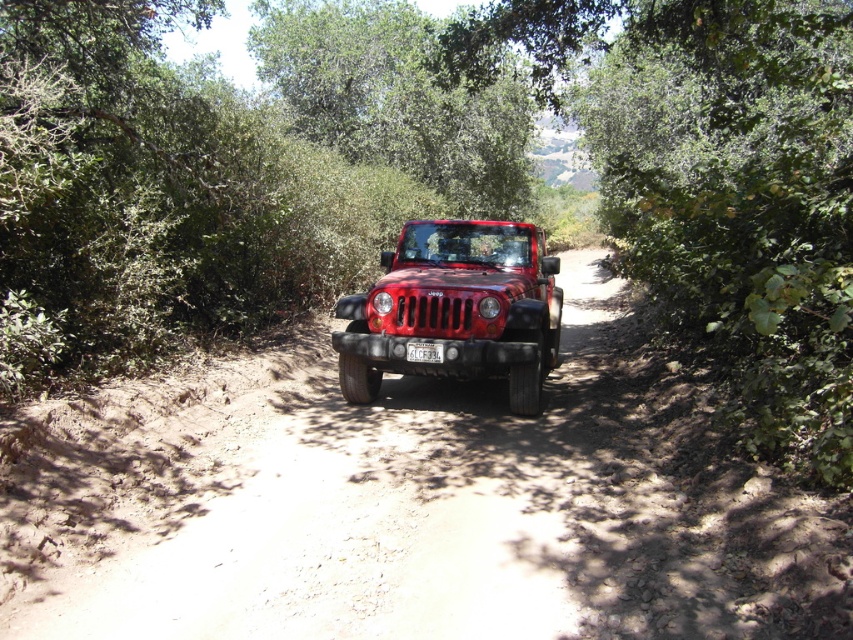
Question: Can you confirm if green leafy tree at center is bigger than matte red jeep at center?

Choices:
 (A) yes
 (B) no

Answer: (A)

Question: Which of the following is the closest to the observer?

Choices:
 (A) green leafy tree at center
 (B) matte red jeep at center

Answer: (A)

Question: Observing the image, what is the correct spatial positioning of green leafy tree at center in reference to matte red jeep at center?

Choices:
 (A) right
 (B) left

Answer: (A)

Question: Can you confirm if green leafy tree at center is bigger than matte red jeep at center?

Choices:
 (A) no
 (B) yes

Answer: (B)

Question: Which of the following is the closest to the observer?

Choices:
 (A) green leafy tree at center
 (B) matte red jeep at center

Answer: (A)